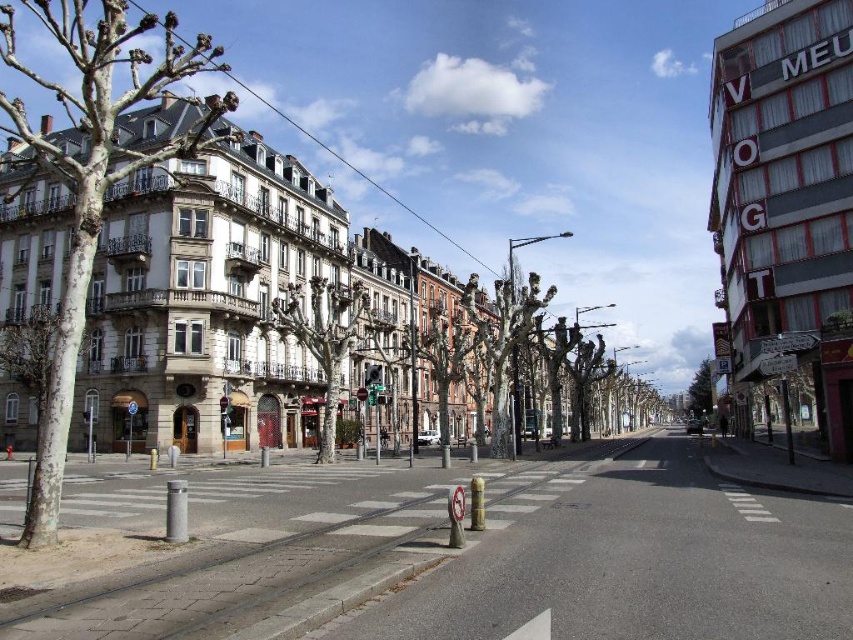
Can you confirm if bare wood tree at center is taller than smooth brown tree at center?

Incorrect, bare wood tree at center's height is not larger of smooth brown tree at center's.

Is point (300, 298) farther from viewer compared to point (412, 340)?

Yes, point (300, 298) is behind point (412, 340).

What are the coordinates of `bare wood tree at center` in the screenshot? It's located at (323, 339).

Between smooth bark tree at left and smooth brown tree at center, which one has less height?

With less height is smooth brown tree at center.

Does point (167, 150) lie behind point (416, 337)?

No, (167, 150) is closer to viewer.

Is point (25, 1) less distant than point (422, 440)?

No, (25, 1) is behind (422, 440).

At what (x,y) coordinates should I click in order to perform the action: click on smooth bark tree at left. Please return your answer as a coordinate pair (x, y). Looking at the image, I should click on (96, 177).

Who is lower down, smooth bark tree at left or green leafy tree at center?

Positioned lower is green leafy tree at center.

Is smooth bark tree at left shorter than green leafy tree at center?

No, smooth bark tree at left is not shorter than green leafy tree at center.

Between point (227, 138) and point (704, 372), which one is positioned in front?

Positioned in front is point (227, 138).

I want to click on smooth bark tree at left, so click(x=96, y=177).